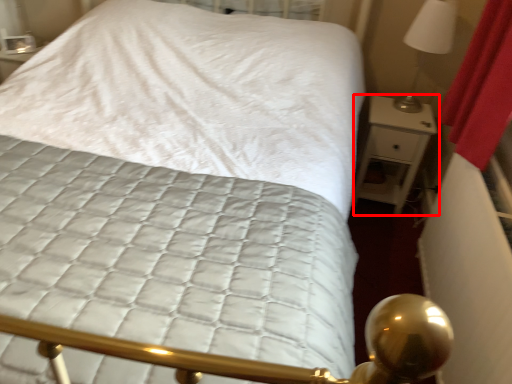
Question: From the image's perspective, where is nightstand (annotated by the red box) located relative to bedside lamp?

Choices:
 (A) below
 (B) above

Answer: (A)